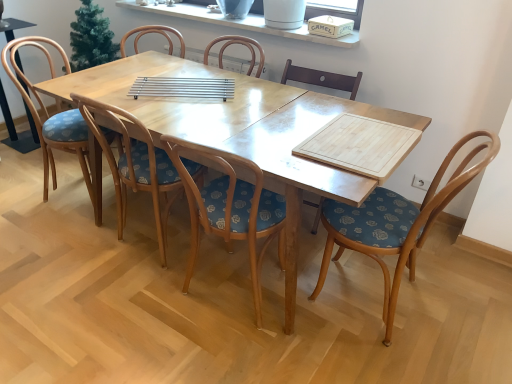
Where is `spots to the right of woodenwoodenchair at right, which is counted as the fifth chair, starting from the left`? spots to the right of woodenwoodenchair at right, which is counted as the fifth chair, starting from the left is located at coordinates (462, 295).